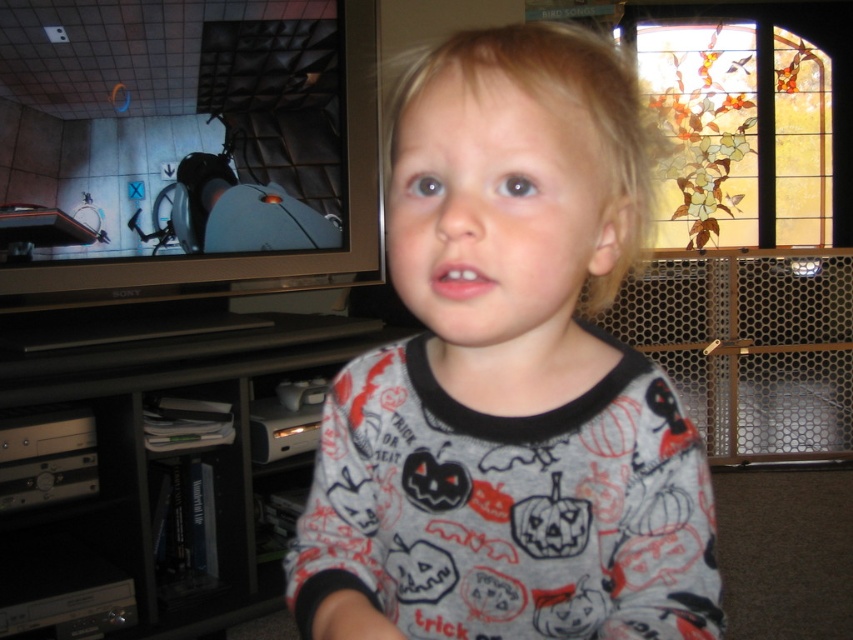
Question: Can you confirm if gray cotton pajamas at center is positioned to the right of black plastic entertainment center at lower left?

Choices:
 (A) yes
 (B) no

Answer: (A)

Question: Is gray cotton pajamas at center thinner than black plastic entertainment center at lower left?

Choices:
 (A) no
 (B) yes

Answer: (B)

Question: In this image, where is gray cotton pajamas at center located relative to black plastic entertainment center at lower left?

Choices:
 (A) above
 (B) below

Answer: (A)